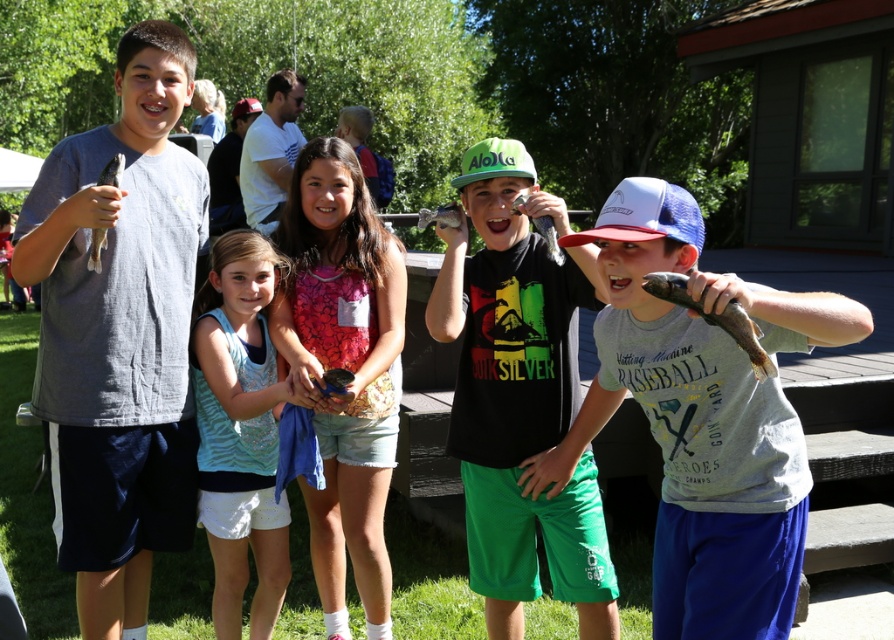
Question: Which point appears farthest from the camera in this image?

Choices:
 (A) (266, 515)
 (B) (122, 460)
 (C) (519, 452)
 (D) (780, 298)

Answer: (A)

Question: Does gray matte shirt at left appear on the right side of gray matte shirt at center?

Choices:
 (A) no
 (B) yes

Answer: (A)

Question: Considering the relative positions of gray matte shirt at center and shiny metallic fish at center in the image provided, where is gray matte shirt at center located with respect to shiny metallic fish at center?

Choices:
 (A) below
 (B) above

Answer: (B)

Question: Where is gray matte shirt at left located in relation to shiny metallic fish at center in the image?

Choices:
 (A) above
 (B) below

Answer: (A)

Question: Based on their relative distances, which object is nearer to the light blue fabric tank top at center?

Choices:
 (A) gray matte shirt at center
 (B) shiny metallic fish at center

Answer: (B)

Question: Considering the real-world distances, which object is closest to the light blue fabric tank top at center?

Choices:
 (A) gray matte shirt at center
 (B) gray matte shirt at left

Answer: (B)